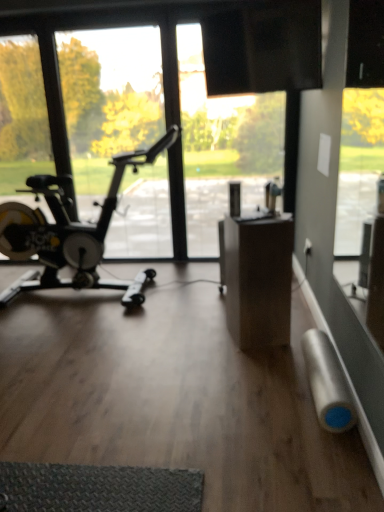
Question: Can you confirm if transparent glass window at left is thinner than silver matte duct tape at lower right?

Choices:
 (A) no
 (B) yes

Answer: (B)

Question: Is transparent glass window at left far away from silver matte duct tape at lower right?

Choices:
 (A) yes
 (B) no

Answer: (A)

Question: Is transparent glass window at left closer to camera compared to silver matte duct tape at lower right?

Choices:
 (A) no
 (B) yes

Answer: (A)

Question: Is silver matte duct tape at lower right surrounded by transparent glass window at left?

Choices:
 (A) yes
 (B) no

Answer: (B)

Question: Is the surface of transparent glass window at left in direct contact with silver matte duct tape at lower right?

Choices:
 (A) no
 (B) yes

Answer: (A)

Question: Relative to silver matte duct tape at lower right, is black matte stationary bicycle at left in front or behind?

Choices:
 (A) front
 (B) behind

Answer: (B)

Question: Considering the positions of black matte stationary bicycle at left and silver matte duct tape at lower right in the image, is black matte stationary bicycle at left taller or shorter than silver matte duct tape at lower right?

Choices:
 (A) short
 (B) tall

Answer: (B)

Question: Do you think black matte stationary bicycle at left is within silver matte duct tape at lower right, or outside of it?

Choices:
 (A) inside
 (B) outside

Answer: (B)

Question: Visually, is black matte stationary bicycle at left positioned to the left or to the right of silver matte duct tape at lower right?

Choices:
 (A) left
 (B) right

Answer: (A)

Question: Considering the positions of silver matte duct tape at lower right and transparent glass window at left in the image, is silver matte duct tape at lower right taller or shorter than transparent glass window at left?

Choices:
 (A) tall
 (B) short

Answer: (B)

Question: Based on their positions, is silver matte duct tape at lower right located to the left or right of transparent glass window at left?

Choices:
 (A) right
 (B) left

Answer: (A)

Question: Is silver matte duct tape at lower right in front of or behind transparent glass window at left in the image?

Choices:
 (A) behind
 (B) front

Answer: (B)

Question: Choose the correct answer: Is silver matte duct tape at lower right inside transparent glass window at left or outside it?

Choices:
 (A) outside
 (B) inside

Answer: (A)

Question: Considering the positions of point (71, 133) and point (19, 253), is point (71, 133) closer or farther from the camera than point (19, 253)?

Choices:
 (A) closer
 (B) farther

Answer: (B)

Question: Is transparent glass window at left inside the boundaries of black matte stationary bicycle at left, or outside?

Choices:
 (A) inside
 (B) outside

Answer: (B)